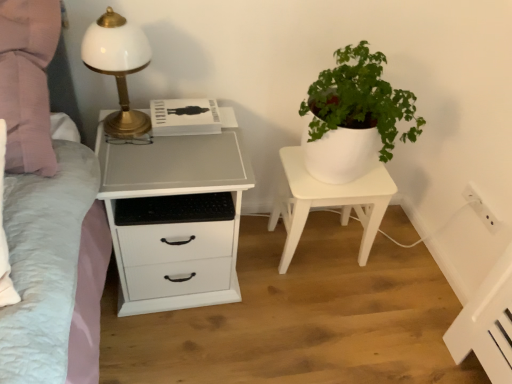
Question: Is white matte chest of drawers at left positioned before white plastic electric outlet at upper right?

Choices:
 (A) no
 (B) yes

Answer: (B)

Question: From the image's perspective, does white matte chest of drawers at left appear lower than white plastic electric outlet at upper right?

Choices:
 (A) no
 (B) yes

Answer: (B)

Question: Can white plastic electric outlet at upper right be found inside white matte chest of drawers at left?

Choices:
 (A) no
 (B) yes

Answer: (A)

Question: Can you confirm if white matte chest of drawers at left is thinner than white plastic electric outlet at upper right?

Choices:
 (A) no
 (B) yes

Answer: (A)

Question: Is white matte chest of drawers at left bigger than white plastic electric outlet at upper right?

Choices:
 (A) no
 (B) yes

Answer: (B)

Question: Are white matte chest of drawers at left and white plastic electric outlet at upper right beside each other?

Choices:
 (A) yes
 (B) no

Answer: (B)

Question: Is white matte plant pot at center thinner than white matte chest of drawers at left?

Choices:
 (A) no
 (B) yes

Answer: (B)

Question: Is white matte plant pot at center not close to white matte chest of drawers at left?

Choices:
 (A) no
 (B) yes

Answer: (A)

Question: Is white matte plant pot at center turned away from white matte chest of drawers at left?

Choices:
 (A) no
 (B) yes

Answer: (A)

Question: Can you see white matte plant pot at center touching white matte chest of drawers at left?

Choices:
 (A) no
 (B) yes

Answer: (A)

Question: Is white matte plant pot at center at the right side of white matte chest of drawers at left?

Choices:
 (A) yes
 (B) no

Answer: (A)

Question: Considering the relative sizes of white matte plant pot at center and white matte chest of drawers at left in the image provided, is white matte plant pot at center smaller than white matte chest of drawers at left?

Choices:
 (A) yes
 (B) no

Answer: (A)

Question: From a real-world perspective, is white matte plant pot at center located higher than white plastic electric outlet at upper right?

Choices:
 (A) no
 (B) yes

Answer: (A)